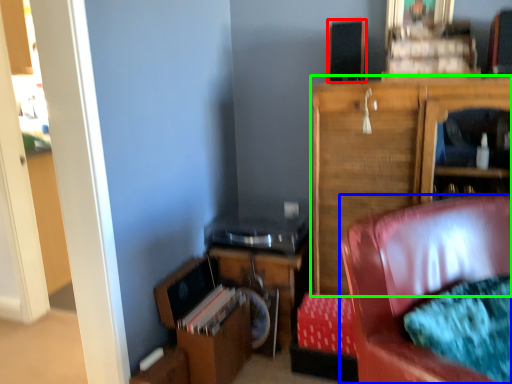
Question: Estimate the real-world distances between objects in this image. Which object is closer to speaker (highlighted by a red box), chair (highlighted by a blue box) or cabinetry (highlighted by a green box)?

Choices:
 (A) chair
 (B) cabinetry

Answer: (B)